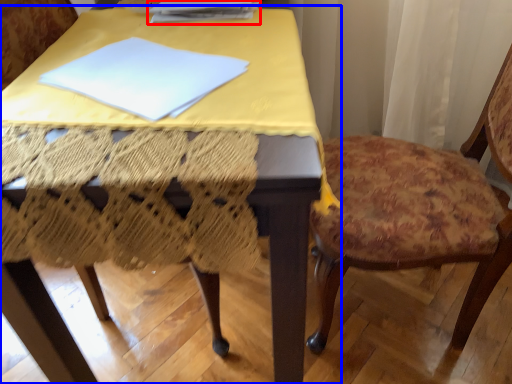
Question: Which object appears closest to the camera in this image, paperback book (highlighted by a red box) or table (highlighted by a blue box)?

Choices:
 (A) paperback book
 (B) table

Answer: (B)